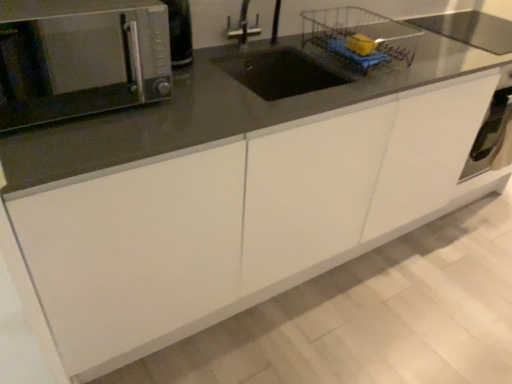
The height and width of the screenshot is (384, 512). Identify the location of vacant space to the right of satin silver microwave at upper left. (200, 114).